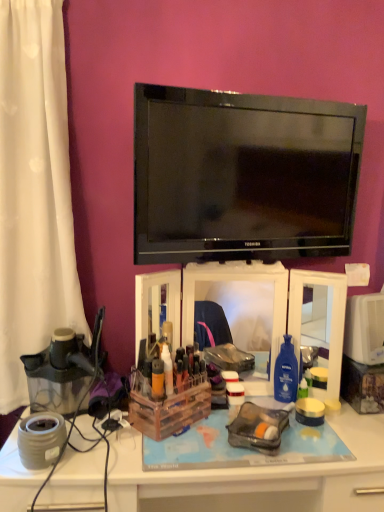
Question: Is white plastic desk at lower center bigger than black glossy tv at upper center?

Choices:
 (A) yes
 (B) no

Answer: (A)

Question: Could black glossy tv at upper center be considered to be inside white plastic desk at lower center?

Choices:
 (A) yes
 (B) no

Answer: (B)

Question: From a real-world perspective, is white plastic desk at lower center physically above black glossy tv at upper center?

Choices:
 (A) yes
 (B) no

Answer: (B)

Question: Is white plastic desk at lower center far away from black glossy tv at upper center?

Choices:
 (A) yes
 (B) no

Answer: (B)

Question: From a real-world perspective, is white plastic desk at lower center under black glossy tv at upper center?

Choices:
 (A) yes
 (B) no

Answer: (A)

Question: Is black glossy tv at upper center inside the boundaries of white plastic desk at lower center, or outside?

Choices:
 (A) outside
 (B) inside

Answer: (A)

Question: In terms of size, does black glossy tv at upper center appear bigger or smaller than white plastic desk at lower center?

Choices:
 (A) big
 (B) small

Answer: (B)

Question: Considering the positions of black glossy tv at upper center and white plastic desk at lower center in the image, is black glossy tv at upper center wider or thinner than white plastic desk at lower center?

Choices:
 (A) thin
 (B) wide

Answer: (A)

Question: Does point (223, 96) appear closer or farther from the camera than point (34, 486)?

Choices:
 (A) farther
 (B) closer

Answer: (A)

Question: Is point (76, 388) closer or farther from the camera than point (314, 121)?

Choices:
 (A) farther
 (B) closer

Answer: (A)

Question: In the image, is transparent plastic juicer at left positioned in front of or behind black glossy tv at upper center?

Choices:
 (A) behind
 (B) front

Answer: (A)

Question: Is transparent plastic juicer at left spatially inside black glossy tv at upper center, or outside of it?

Choices:
 (A) inside
 (B) outside

Answer: (B)

Question: From the image's perspective, is transparent plastic juicer at left above or below black glossy tv at upper center?

Choices:
 (A) above
 (B) below

Answer: (B)

Question: In terms of height, does wooden/clear plastic storage box at center look taller or shorter compared to transparent plastic juicer at left?

Choices:
 (A) tall
 (B) short

Answer: (B)

Question: Would you say wooden/clear plastic storage box at center is to the left or to the right of transparent plastic juicer at left in the picture?

Choices:
 (A) right
 (B) left

Answer: (A)